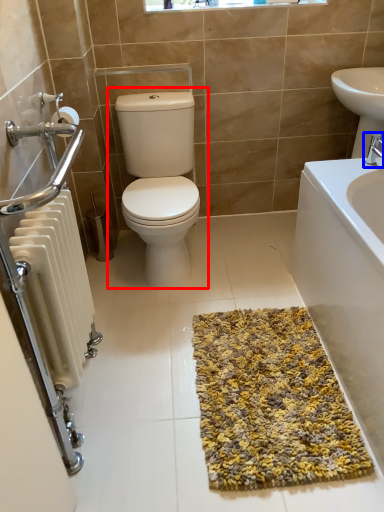
Question: Among these objects, which one is farthest to the camera, toilet (highlighted by a red box) or tap (highlighted by a blue box)?

Choices:
 (A) toilet
 (B) tap

Answer: (B)